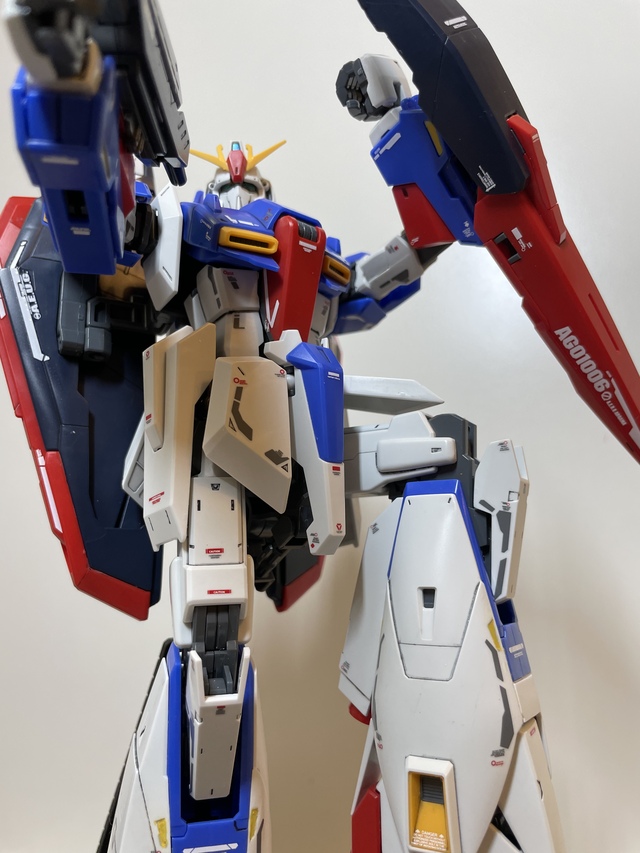
The image size is (640, 853). What are the coordinates of `white painted wall` in the screenshot? It's located at (271, 65).